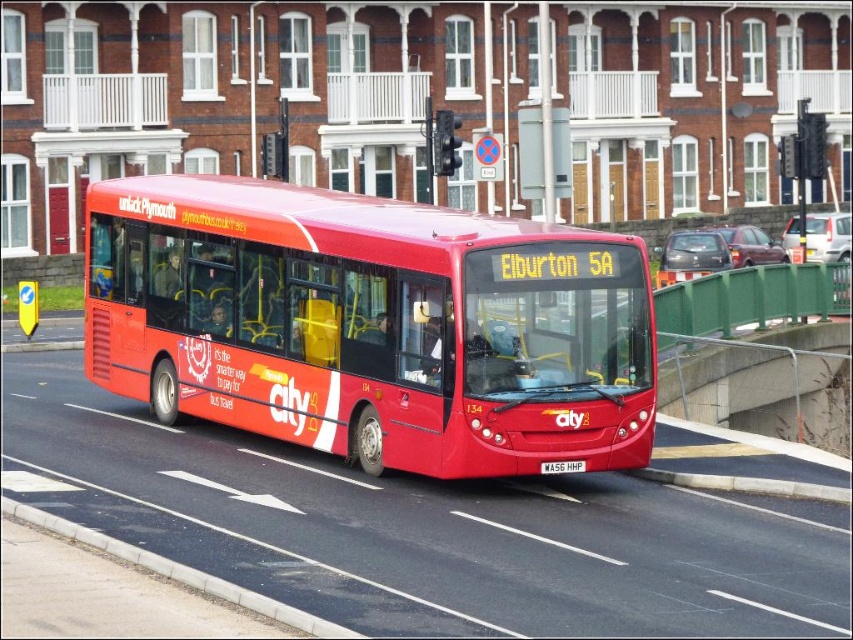
Can you confirm if shiny red bus at center is shorter than black asphalt curb at lower left?

No, shiny red bus at center is not shorter than black asphalt curb at lower left.

Can you confirm if shiny red bus at center is positioned below black asphalt curb at lower left?

Incorrect, shiny red bus at center is not positioned below black asphalt curb at lower left.

Where is `shiny red bus at center`? shiny red bus at center is located at coordinates (370, 324).

Can you confirm if shiny red bus at center is taller than white matte license plate at center?

Yes.

Looking at this image, can you confirm if shiny red bus at center is smaller than white matte license plate at center?

Incorrect, shiny red bus at center is not smaller in size than white matte license plate at center.

Describe the element at coordinates (370, 324) in the screenshot. This screenshot has width=853, height=640. I see `shiny red bus at center` at that location.

Image resolution: width=853 pixels, height=640 pixels. I want to click on shiny red bus at center, so click(x=370, y=324).

Who is more forward, [172,573] or [578,472]?

Point [172,573] is more forward.

In the scene shown: Which of these two, black asphalt curb at lower left or white matte license plate at center, stands shorter?

With less height is white matte license plate at center.

Describe the element at coordinates (177, 572) in the screenshot. I see `black asphalt curb at lower left` at that location.

I want to click on black asphalt curb at lower left, so click(177, 572).